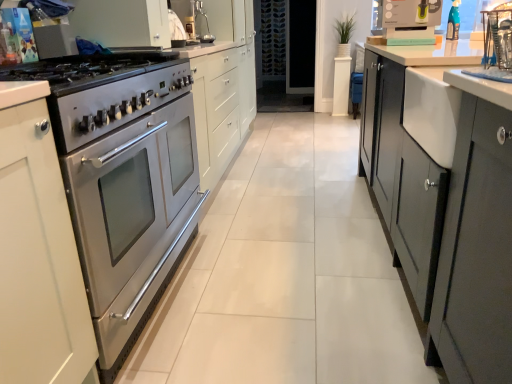
The height and width of the screenshot is (384, 512). What do you see at coordinates (191, 19) in the screenshot?
I see `matte silver sink at upper center` at bounding box center [191, 19].

Looking at this image, what is the approximate height of stainless steel oven at left?

It is 29.78 inches.

Describe the element at coordinates (133, 219) in the screenshot. I see `stainless steel oven at left` at that location.

Describe the element at coordinates (286, 275) in the screenshot. I see `stainless steel oven at left` at that location.

Where is `stainless steel oven at left`? The image size is (512, 384). stainless steel oven at left is located at coordinates (286, 275).

Describe the element at coordinates (410, 21) in the screenshot. I see `matte yellow kettle at upper right` at that location.

Measure the distance between matte yellow kettle at upper right and camera.

A distance of 7.34 feet exists between matte yellow kettle at upper right and camera.

Locate an element on the screen. matte silver sink at upper center is located at coordinates (191, 19).

Can you confirm if matte silver sink at upper center is taller than stainless steel oven at left?

Yes, matte silver sink at upper center is taller than stainless steel oven at left.

Is matte silver sink at upper center to the left of stainless steel oven at left from the viewer's perspective?

Yes.

Is matte silver sink at upper center not near stainless steel oven at left?

Absolutely, matte silver sink at upper center is distant from stainless steel oven at left.

Is matte silver sink at upper center positioned with its back to stainless steel oven at left?

No.

Between stainless steel oven at left and transparent glass door at center, which one is positioned in front?

Positioned in front is stainless steel oven at left.

Which is less distant, (387, 296) or (308, 61)?

Point (387, 296) is closer to the camera than point (308, 61).

Who is bigger, stainless steel oven at left or transparent glass door at center?

stainless steel oven at left.

From the picture: Is satin silver gas stove at left aimed at matte yellow kettle at upper right?

No, satin silver gas stove at left is not facing towards matte yellow kettle at upper right.

Considering the relative sizes of satin silver gas stove at left and matte yellow kettle at upper right in the image provided, is satin silver gas stove at left taller than matte yellow kettle at upper right?

Correct, satin silver gas stove at left is much taller as matte yellow kettle at upper right.

Considering the positions of point (39, 79) and point (438, 16), is point (39, 79) closer or farther from the camera than point (438, 16)?

Point (39, 79).

Locate an element on the screen. This screenshot has height=384, width=512. oven on the right of the satin silver gas stove at left is located at coordinates (133, 219).

Is stainless steel oven at left oriented towards satin silver gas stove at left?

No, stainless steel oven at left is not oriented towards satin silver gas stove at left.

From the image's perspective, is stainless steel oven at left located beneath satin silver gas stove at left?

Yes, from the image's perspective, stainless steel oven at left is beneath satin silver gas stove at left.

Considering the sizes of stainless steel oven at left and satin silver gas stove at left in the image, is stainless steel oven at left wider or thinner than satin silver gas stove at left?

stainless steel oven at left is thinner than satin silver gas stove at left.

Between transparent glass door at center and stainless steel oven at left, which one has larger width?

Wider between the two is stainless steel oven at left.

Are transparent glass door at center and stainless steel oven at left far apart?

Indeed, transparent glass door at center is not near stainless steel oven at left.

Can you confirm if transparent glass door at center is smaller than stainless steel oven at left?

Yes.

Is point (271, 66) closer or farther from the camera than point (349, 169)?

Clearly, point (271, 66) is more distant from the camera than point (349, 169).

From the image's perspective, is stainless steel oven at left on stainless steel oven at left?

No, from the image's perspective, stainless steel oven at left is not over stainless steel oven at left.

Is stainless steel oven at left positioned far away from stainless steel oven at left?

Actually, stainless steel oven at left and stainless steel oven at left are a little close together.

In the scene shown: From a real-world perspective, is stainless steel oven at left located beneath stainless steel oven at left?

No.

Which of these two, stainless steel oven at left or stainless steel oven at left, is wider?

stainless steel oven at left is wider.

Locate an element on the screen. The width and height of the screenshot is (512, 384). sink that appears on the left of transparent glass door at center is located at coordinates (191, 19).

From the image's perspective, is matte silver sink at upper center under transparent glass door at center?

Yes, from the image's perspective, matte silver sink at upper center is below transparent glass door at center.

From a real-world perspective, is matte silver sink at upper center positioned under transparent glass door at center based on gravity?

No, from a real-world perspective, matte silver sink at upper center is not beneath transparent glass door at center.

In the image, is matte silver sink at upper center positioned in front of or behind transparent glass door at center?

A: matte silver sink at upper center is positioned closer to the viewer than transparent glass door at center.

Where is `sink above the stainless steel oven at left (from the image's perspective)`? The height and width of the screenshot is (384, 512). sink above the stainless steel oven at left (from the image's perspective) is located at coordinates (191, 19).

I want to click on plain lying in front of the transparent glass door at center, so click(286, 275).

When comparing their distances from transparent glass door at center, does stainless steel oven at left or matte yellow kettle at upper right seem further?

stainless steel oven at left is further to transparent glass door at center.

Looking at the image, which one is located closer to stainless steel oven at left, stainless steel oven at left or matte silver sink at upper center?

stainless steel oven at left lies closer to stainless steel oven at left than the other object.

Looking at the image, which one is located closer to stainless steel oven at left, satin silver gas stove at left or matte yellow kettle at upper right?

Based on the image, satin silver gas stove at left appears to be nearer to stainless steel oven at left.

When comparing their distances from matte yellow kettle at upper right, does satin silver gas stove at left or transparent glass door at center seem further?

transparent glass door at center is positioned further to the anchor matte yellow kettle at upper right.

Estimate the real-world distances between objects in this image. Which object is further from matte silver sink at upper center, transparent glass door at center or satin silver gas stove at left?

transparent glass door at center lies further to matte silver sink at upper center than the other object.

When comparing their distances from transparent glass door at center, does satin silver gas stove at left or matte yellow kettle at upper right seem further?

satin silver gas stove at left.

Based on their spatial positions, is stainless steel oven at left or transparent glass door at center further from matte silver sink at upper center?

Based on the image, transparent glass door at center appears to be further to matte silver sink at upper center.

When comparing their distances from transparent glass door at center, does satin silver gas stove at left or stainless steel oven at left seem closer?

satin silver gas stove at left.

Identify the location of oven located between satin silver gas stove at left and matte yellow kettle at upper right in the left-right direction. (133, 219).

The height and width of the screenshot is (384, 512). What are the coordinates of `appliance between stainless steel oven at left and transparent glass door at center from front to back` in the screenshot? It's located at (410, 21).

I want to click on plain between stainless steel oven at left and matte silver sink at upper center along the z-axis, so [x=286, y=275].

I want to click on plain positioned between satin silver gas stove at left and transparent glass door at center from near to far, so click(x=286, y=275).